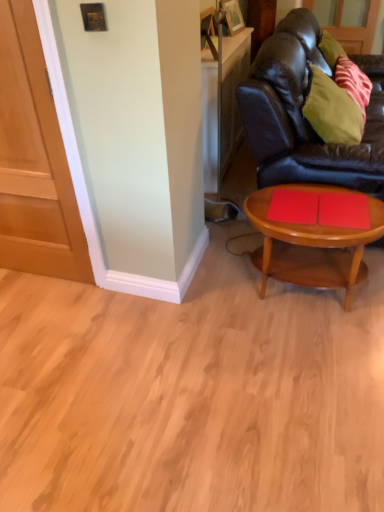
The width and height of the screenshot is (384, 512). What are the coordinates of `free spot above wooden coffee table at lower right (from a real-world perspective)` in the screenshot? It's located at (316, 210).